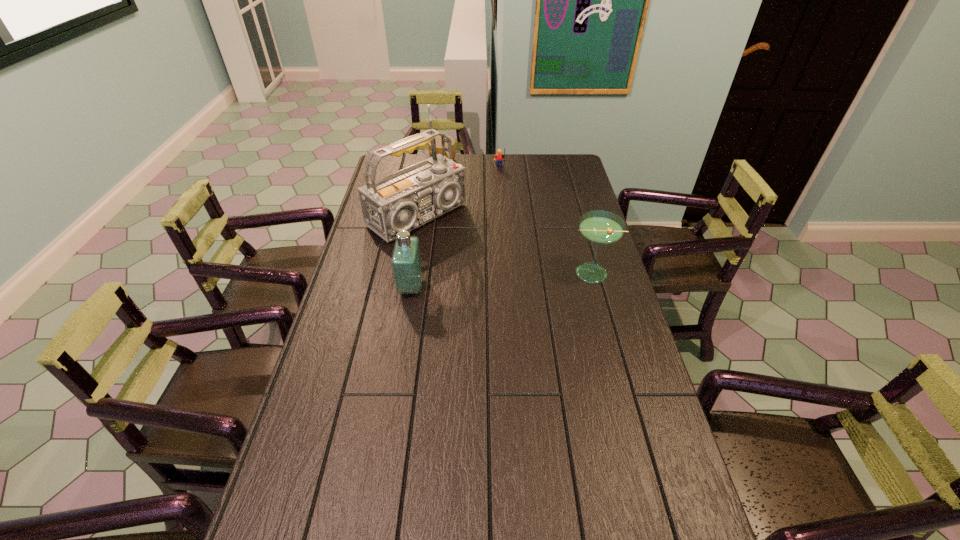
Where is `free point between the martini and the second object from right to left`? The image size is (960, 540). free point between the martini and the second object from right to left is located at coordinates (544, 220).

Where is `vacant point located between the fourth object from left to right and the martini`? The width and height of the screenshot is (960, 540). vacant point located between the fourth object from left to right and the martini is located at coordinates (544, 220).

The width and height of the screenshot is (960, 540). In order to click on free space between the shortest object and the rightmost object in this screenshot , I will do `click(516, 218)`.

Where is `unoccupied area between the mug and the perfume`? The width and height of the screenshot is (960, 540). unoccupied area between the mug and the perfume is located at coordinates (426, 225).

The width and height of the screenshot is (960, 540). What are the coordinates of `free area in between the radio receiver and the rightmost object` in the screenshot? It's located at (503, 244).

The height and width of the screenshot is (540, 960). What are the coordinates of `free area in between the rightmost object and the tallest object` in the screenshot? It's located at (503, 244).

Image resolution: width=960 pixels, height=540 pixels. Find the location of `free spot between the martini and the perfume`. free spot between the martini and the perfume is located at coordinates (500, 280).

The image size is (960, 540). What are the coordinates of `vacant area that lies between the second object from right to left and the mug` in the screenshot? It's located at (471, 165).

You are a GUI agent. You are given a task and a screenshot of the screen. Output one action in this format:
    pyautogui.click(x=<x>, y=<y>)
    Task: Click on the free spot between the rightmost object and the third farthest object
    
    Given the screenshot: What is the action you would take?
    pyautogui.click(x=503, y=244)

The width and height of the screenshot is (960, 540). What are the coordinates of `unoccupied area between the mug and the martini` in the screenshot? It's located at (516, 218).